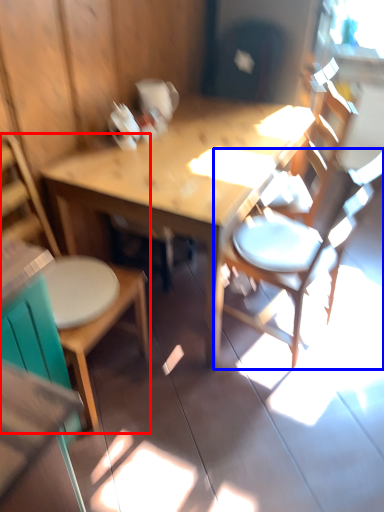
Question: Which point is closer to the camera, chair (highlighted by a red box) or chair (highlighted by a blue box)?

Choices:
 (A) chair
 (B) chair

Answer: (A)